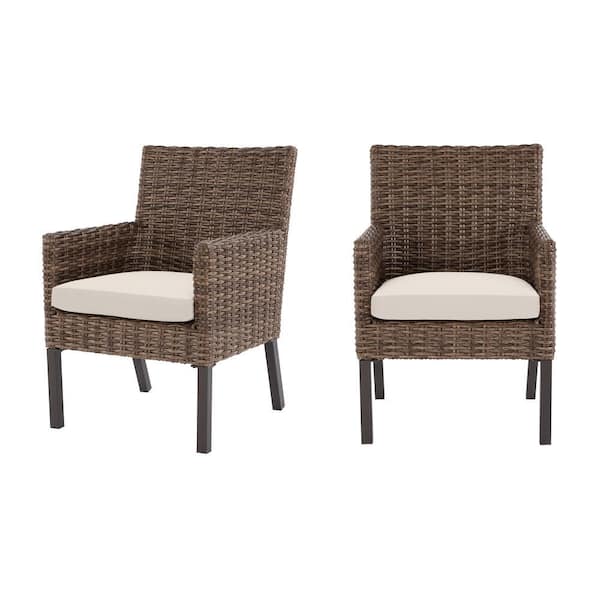
Where is `seat cushion`? seat cushion is located at coordinates (452, 297), (148, 292).